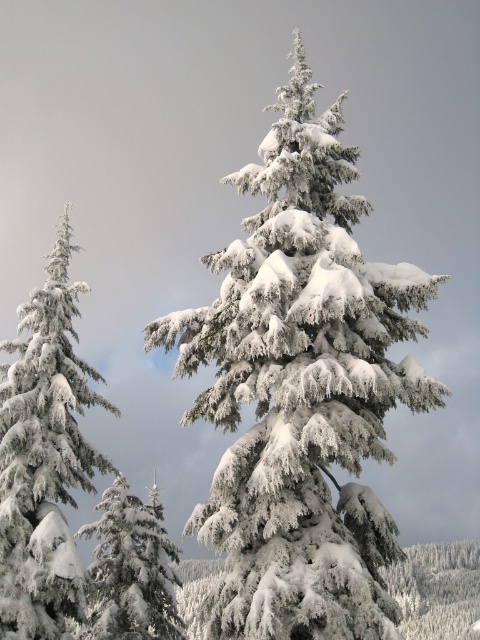
Is point (332, 528) positioned before point (48, 604)?

Yes, point (332, 528) is in front of point (48, 604).

Does snow-covered evergreen at center appear under white frosty pine at left?

Incorrect, snow-covered evergreen at center is not positioned below white frosty pine at left.

Image resolution: width=480 pixels, height=640 pixels. What do you see at coordinates (300, 388) in the screenshot?
I see `snow-covered evergreen at center` at bounding box center [300, 388].

Identify the location of snow-covered evergreen at center. The width and height of the screenshot is (480, 640). (300, 388).

Is snow-covered evergreen at center wider than white frosty pine at lower left?

Incorrect, snow-covered evergreen at center's width does not surpass white frosty pine at lower left's.

Find the location of `snow-covered evergreen at center`. snow-covered evergreen at center is located at coordinates (300, 388).

Looking at this image, does white frosty pine at left come behind white frosty pine at lower left?

No, it is not.

Which of these two, white frosty pine at left or white frosty pine at lower left, stands taller?

white frosty pine at lower left is taller.

Is point (52, 576) positioned before point (156, 490)?

Yes, point (52, 576) is closer to viewer.

Where is `white frosty pine at left`? The image size is (480, 640). white frosty pine at left is located at coordinates (45, 456).